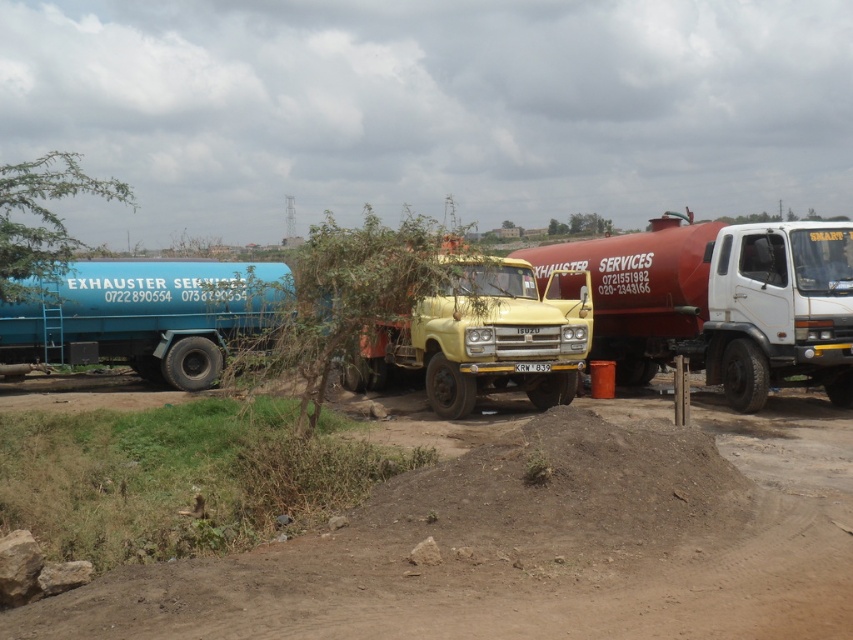
Question: Which point is farther to the camera?

Choices:
 (A) matte red tanker at center
 (B) brown dirt track at lower center
 (C) green leafy tree at upper center
 (D) green leafy tree at upper left

Answer: (C)

Question: Is green leafy tree at upper left wider than green leafy tree at upper center?

Choices:
 (A) no
 (B) yes

Answer: (B)

Question: Which object is positioned farthest from the green leafy tree at center?

Choices:
 (A) matte red tanker at center
 (B) green leafy tree at upper center

Answer: (B)

Question: Does matte red tanker at center have a lesser width compared to green leafy tree at center?

Choices:
 (A) no
 (B) yes

Answer: (B)

Question: Does yellow matte truck at center appear on the right side of green leafy tree at center?

Choices:
 (A) no
 (B) yes

Answer: (B)

Question: Which object appears farthest from the camera in this image?

Choices:
 (A) yellow matte truck at center
 (B) green leafy tree at upper center
 (C) green leafy tree at upper left

Answer: (B)